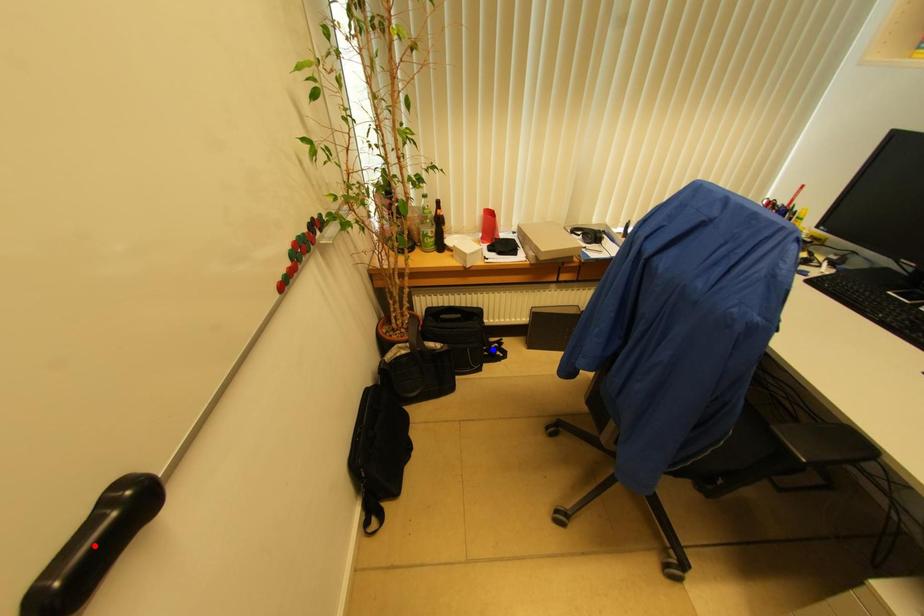
Question: Which of the two points in the image is closer to the camera?

Choices:
 (A) Blue point is closer.
 (B) Red point is closer.

Answer: (B)